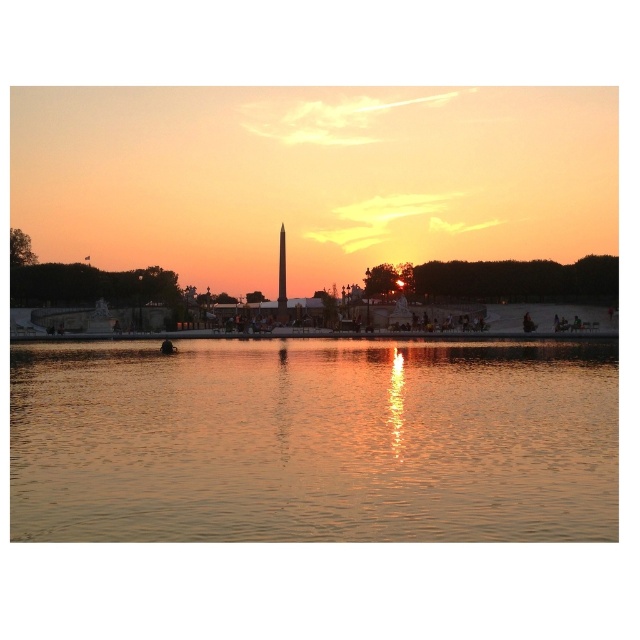
Question: Can you confirm if golden reflective water at center is positioned below polished stone obelisk at center?

Choices:
 (A) yes
 (B) no

Answer: (A)

Question: Which of the following is the farthest from the observer?

Choices:
 (A) golden reflective water at center
 (B) polished stone obelisk at center

Answer: (B)

Question: Is golden reflective water at center closer to the viewer compared to polished stone obelisk at center?

Choices:
 (A) no
 (B) yes

Answer: (B)

Question: Does golden reflective water at center have a greater width compared to polished stone obelisk at center?

Choices:
 (A) no
 (B) yes

Answer: (B)

Question: Which point is closer to the camera taking this photo?

Choices:
 (A) (522, 451)
 (B) (284, 240)

Answer: (A)